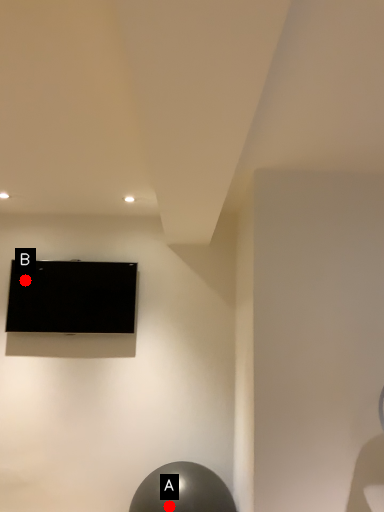
Question: Two points are circled on the image, labeled by A and B beside each circle. Which point appears closest to the camera in this image?

Choices:
 (A) A is closer
 (B) B is closer

Answer: (A)